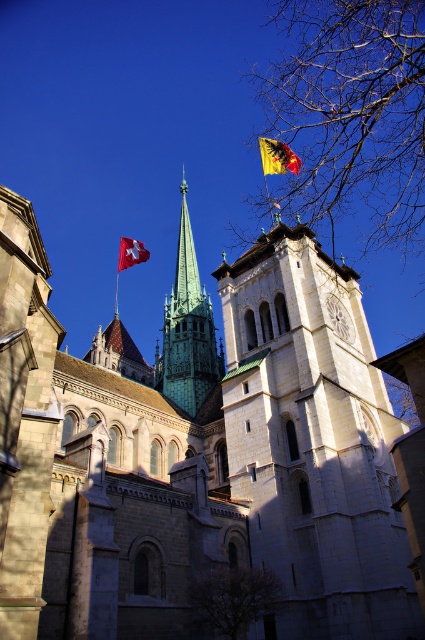
Consider the image. Between green copper spire at center and yellow fabric flag at upper center, which one has more height?

green copper spire at center is taller.

Who is shorter, green copper spire at center or yellow fabric flag at upper center?

With less height is yellow fabric flag at upper center.

Locate an element on the screen. The height and width of the screenshot is (640, 425). green copper spire at center is located at coordinates [187, 330].

Which of these two, green copper spire at upper center or bare branches at lower center, stands taller?

With more height is green copper spire at upper center.

Which is in front, point (25, 557) or point (210, 588)?

Positioned in front is point (25, 557).

Is point (272, 337) closer to camera compared to point (223, 611)?

No, it is behind (223, 611).

Find the location of `green copper spire at upper center`. green copper spire at upper center is located at coordinates (198, 451).

Who is higher up, green copper spire at upper center or bare branches at upper center?

Positioned higher is bare branches at upper center.

Is green copper spire at upper center above bare branches at upper center?

No, green copper spire at upper center is not above bare branches at upper center.

Is point (249, 294) closer to viewer compared to point (424, 40)?

No, it is not.

Find the location of `green copper spire at upper center`. green copper spire at upper center is located at coordinates (198, 451).